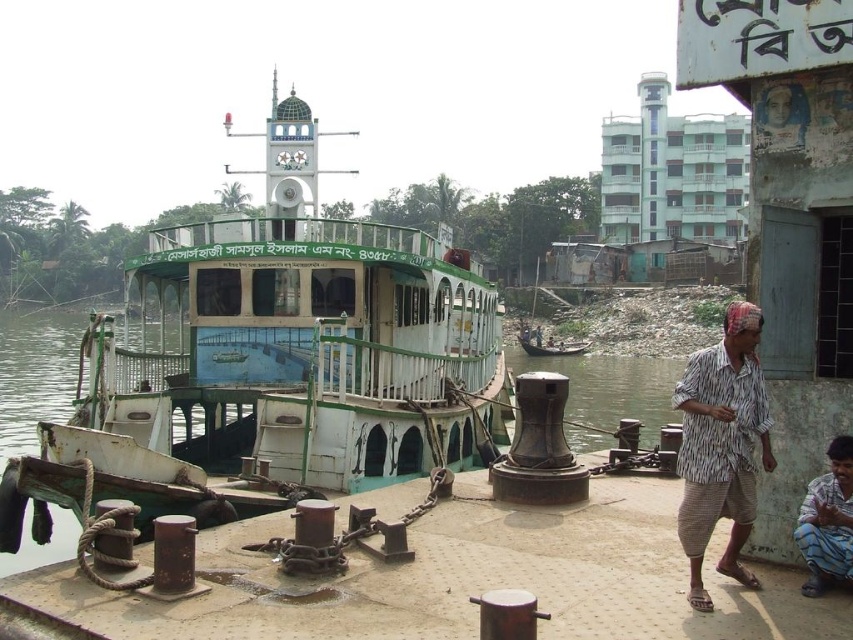
Is blue striped shirt at lower right above wooden boat at center?

No.

Is blue striped shirt at lower right positioned at the back of wooden boat at center?

No, blue striped shirt at lower right is in front of wooden boat at center.

Describe the element at coordinates (827, 522) in the screenshot. The width and height of the screenshot is (853, 640). I see `blue striped shirt at lower right` at that location.

In order to click on blue striped shirt at lower right in this screenshot , I will do `click(827, 522)`.

Between striped fabric shirt at lower right and blue striped shirt at lower right, which one appears on the left side from the viewer's perspective?

blue striped shirt at lower right is more to the left.

Does striped fabric shirt at lower right appear under blue striped shirt at lower right?

No, striped fabric shirt at lower right is not below blue striped shirt at lower right.

Between point (695, 577) and point (834, 442), which one is positioned in front?

Point (695, 577)

You are a GUI agent. You are given a task and a screenshot of the screen. Output one action in this format:
    pyautogui.click(x=<x>, y=<y>)
    Task: Click on the striped fabric shirt at lower right
    The image size is (853, 640).
    Given the screenshot: What is the action you would take?
    pyautogui.click(x=721, y=445)

Is point (677, 518) closer to viewer compared to point (537, 330)?

Yes.

Can you confirm if striped fabric shirt at lower right is positioned below wooden boat at center?

Actually, striped fabric shirt at lower right is above wooden boat at center.

Who is more forward, (701, 604) or (526, 348)?

Point (701, 604)

Locate an element on the screen. striped fabric shirt at lower right is located at coordinates (721, 445).